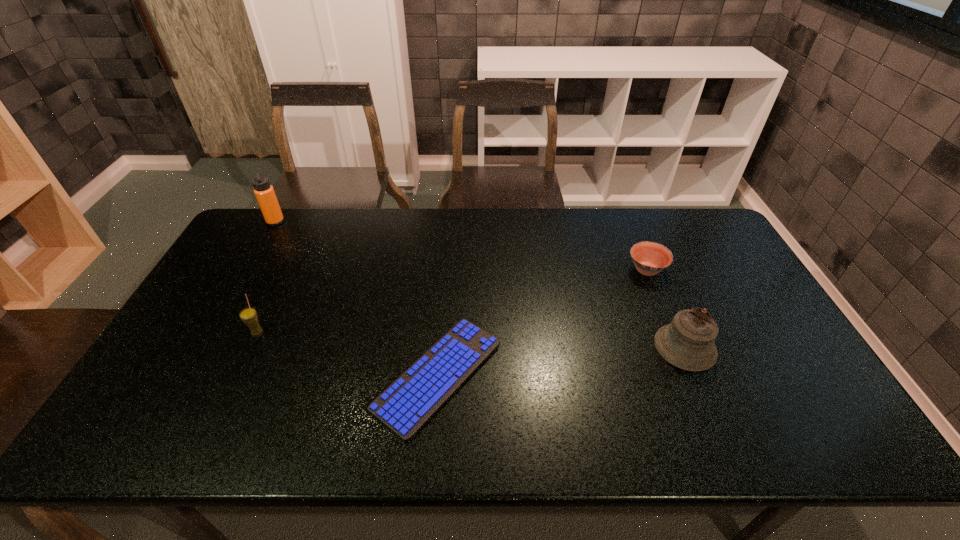
Locate an element on the screen. This screenshot has height=540, width=960. the tallest object is located at coordinates tap(264, 192).

I want to click on thermos bottle, so click(x=264, y=192).

Locate an element on the screen. bell is located at coordinates (687, 343).

Find the location of a particular element. This screenshot has height=540, width=960. the third shortest object is located at coordinates (248, 315).

You are a GUI agent. You are given a task and a screenshot of the screen. Output one action in this format:
    pyautogui.click(x=<x>, y=<y>)
    Task: Click on the fourth object from right to left
    The width and height of the screenshot is (960, 540).
    Given the screenshot: What is the action you would take?
    pyautogui.click(x=248, y=315)

The height and width of the screenshot is (540, 960). I want to click on the second farthest object, so click(x=650, y=258).

What are the coordinates of `the fourth tallest object` in the screenshot? It's located at (650, 258).

This screenshot has height=540, width=960. I want to click on computer keyboard, so click(x=414, y=398).

The image size is (960, 540). I want to click on the shortest object, so click(x=414, y=398).

Locate an element on the screen. This screenshot has height=540, width=960. vacant region located on the front of the thermos bottle is located at coordinates (249, 268).